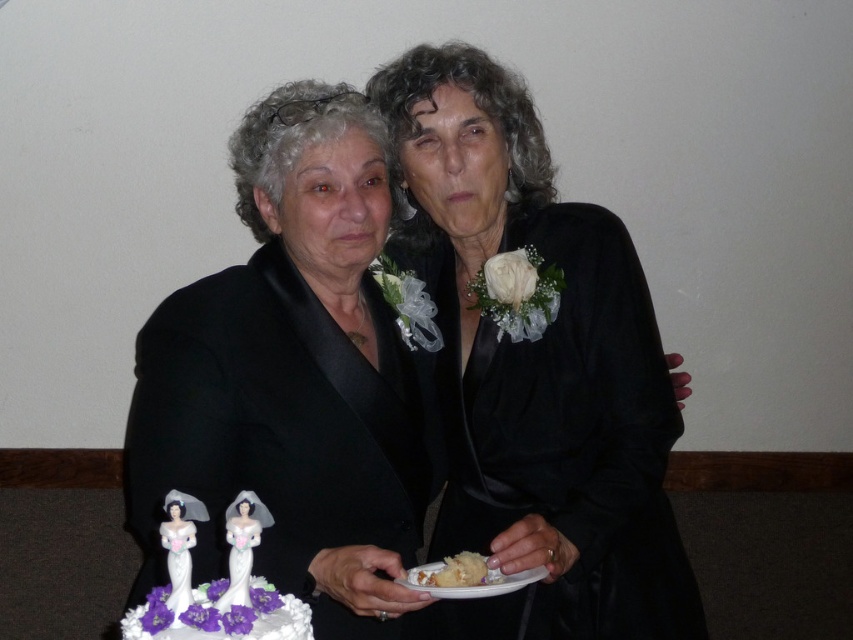
Question: Is black satin suit at center positioned at the back of white fluffy cake at center?

Choices:
 (A) no
 (B) yes

Answer: (A)

Question: Which object is closer to the camera taking this photo?

Choices:
 (A) white fondant cake at lower center
 (B) white fluffy cake at center
 (C) black satin suit at center

Answer: (A)

Question: Which point is closer to the camera taking this photo?

Choices:
 (A) (582, 552)
 (B) (444, 573)

Answer: (B)

Question: Which of these objects is positioned closest to the white fluffy cake at center?

Choices:
 (A) black satin suit at center
 (B) white fondant cake at lower center

Answer: (A)

Question: Does black satin suit at center appear on the right side of white fluffy cake at center?

Choices:
 (A) yes
 (B) no

Answer: (B)

Question: Is black satin suit at center to the left of white fluffy cake at center from the viewer's perspective?

Choices:
 (A) no
 (B) yes

Answer: (B)